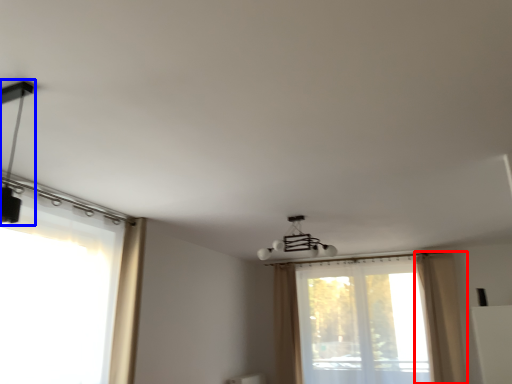
Question: Which object appears farthest to the camera in this image, curtain (highlighted by a red box) or lamp (highlighted by a blue box)?

Choices:
 (A) curtain
 (B) lamp

Answer: (A)